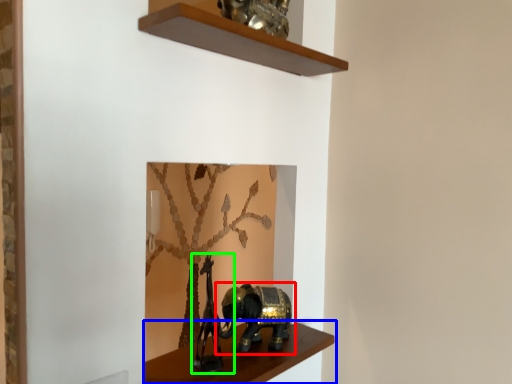
Question: Considering the real-world distances, which object is farthest from elephant (highlighted by a red box)? shelf (highlighted by a blue box) or animal sculpture (highlighted by a green box)?

Choices:
 (A) shelf
 (B) animal sculpture

Answer: (B)